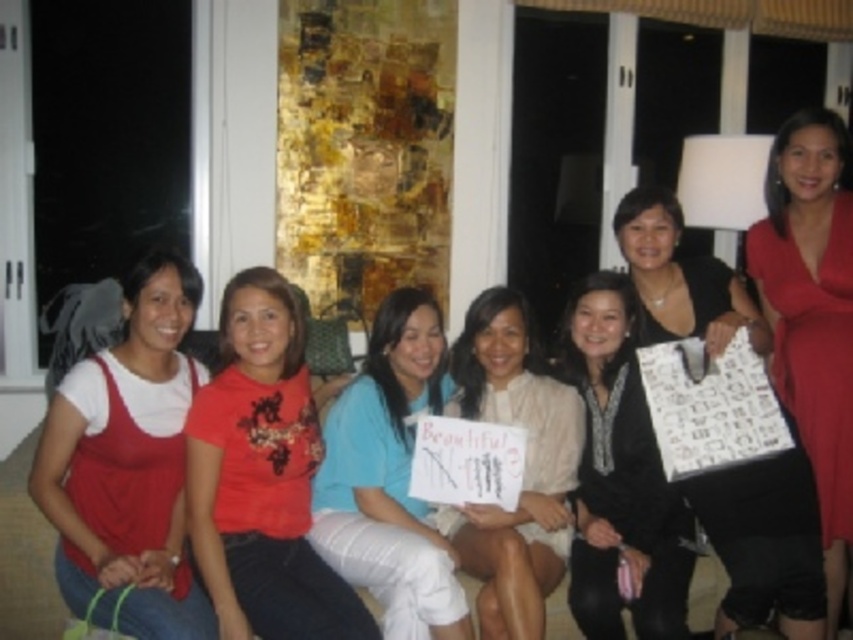
You are a photographer setting up for a group photo. You notice the black satin dress at center and the white matte sign at center. Which object is positioned higher in the image?

The black satin dress at center is above the white matte sign at center, so it is positioned higher in the image.

Based on the photo, you are planning to take a photo of the black satin dress at center and the white matte sign at center for an online catalog. Which object should be placed closer to the camera to ensure both appear the same size in the final image?

The black satin dress at center should be placed closer to the camera because it is smaller than the white matte sign at center. By positioning the smaller dress nearer to the camera, its size in the photo will balance with the larger sign, making them appear equal in the final image.